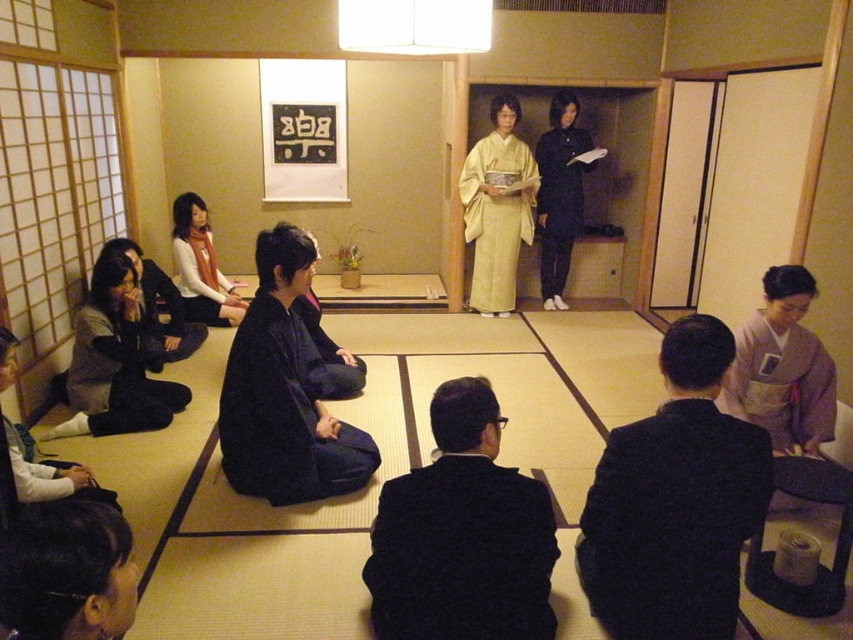
Question: Which object is positioned farthest from the dark blue fabric kimono at lower left?

Choices:
 (A) purple silk kimono at lower right
 (B) white matte robe at lower left

Answer: (A)

Question: Can you confirm if dark gray fabric pants at lower left is wider than white matte robe at lower left?

Choices:
 (A) yes
 (B) no

Answer: (A)

Question: Where is dark blue suit at lower right located in relation to white matte robe at lower left in the image?

Choices:
 (A) right
 (B) left

Answer: (A)

Question: Which is farther from the white matte robe at lower left?

Choices:
 (A) dark blue kimono at center
 (B) dark blue suit at lower right
 (C) dark blue fabric kimono at lower left
 (D) black silk kimono at lower left

Answer: (B)

Question: Is dark blue suit at lower right thinner than dark blue kimono at center?

Choices:
 (A) no
 (B) yes

Answer: (B)

Question: Which of the following is the farthest from the observer?

Choices:
 (A) (215, 289)
 (B) (170, 326)
 (C) (547, 259)

Answer: (C)